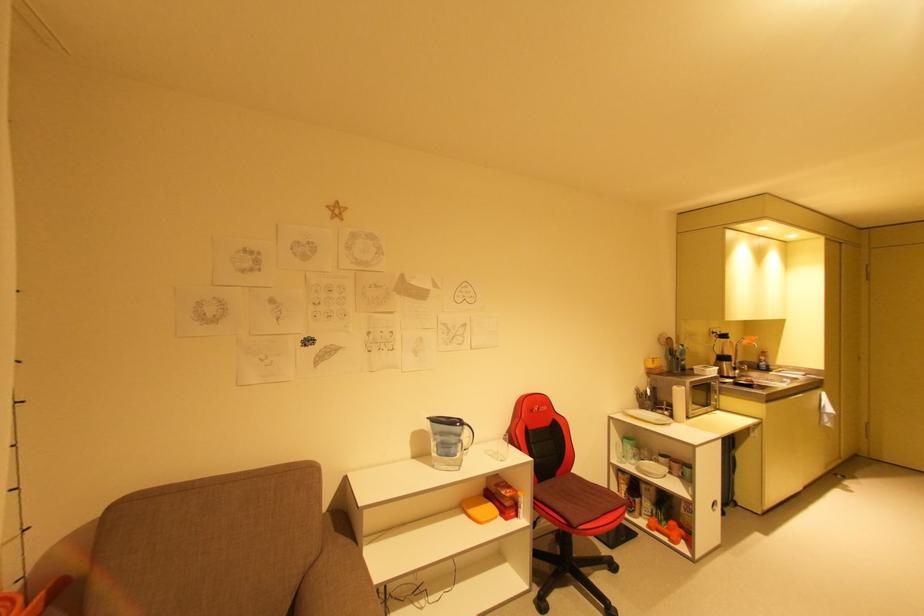
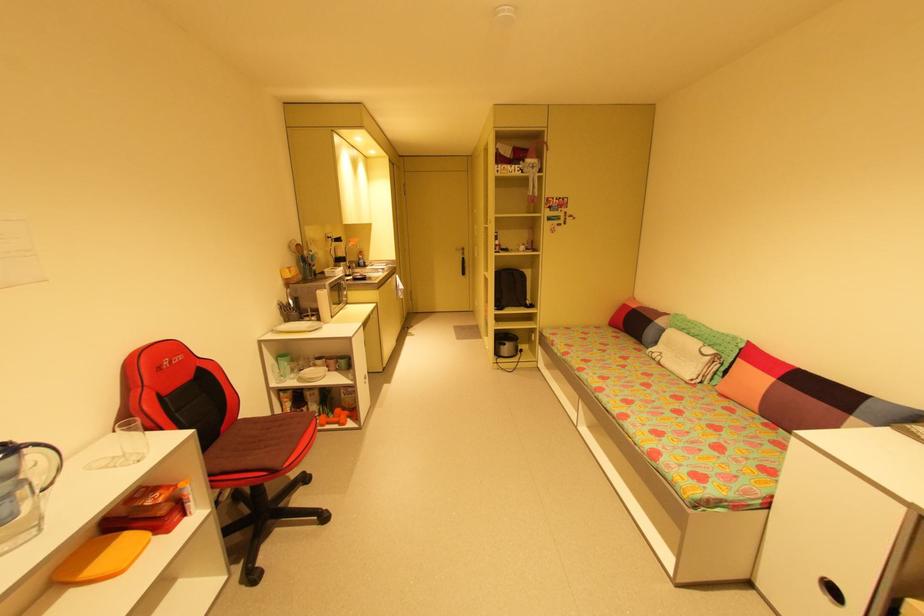
Find the pixel in the second image that matches the point at 634,447 in the first image.

(290, 363)